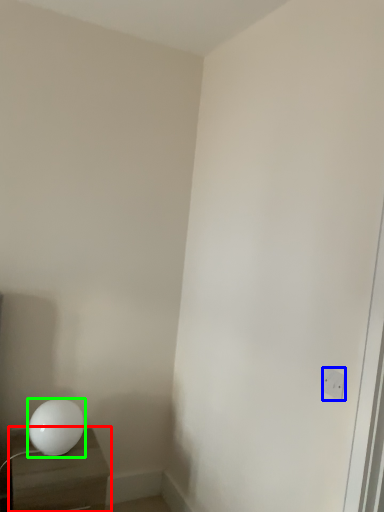
Question: Which object is the closest to the nightstand (highlighted by a red box)? Choose among these: electric outlet (highlighted by a blue box) or lamp (highlighted by a green box).

Choices:
 (A) electric outlet
 (B) lamp

Answer: (B)